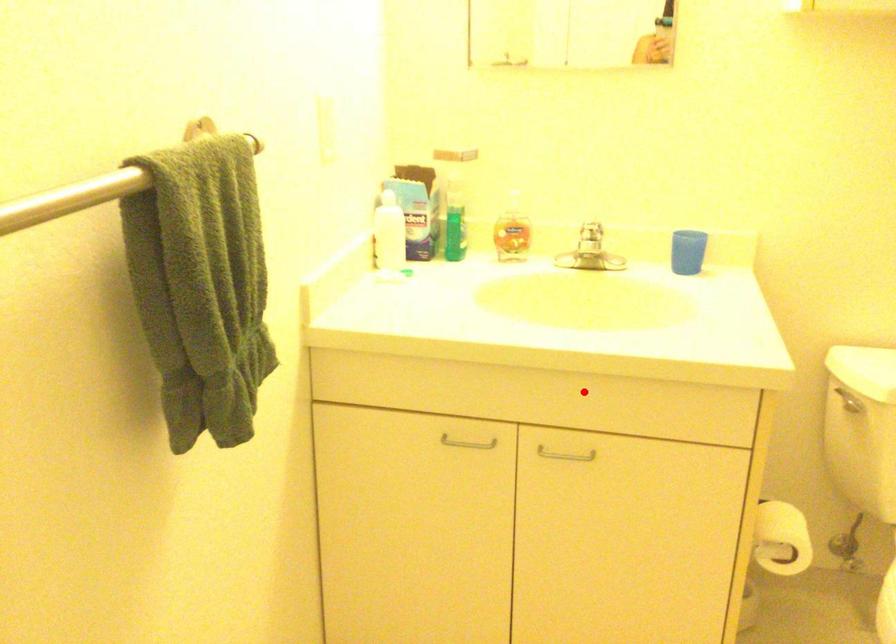
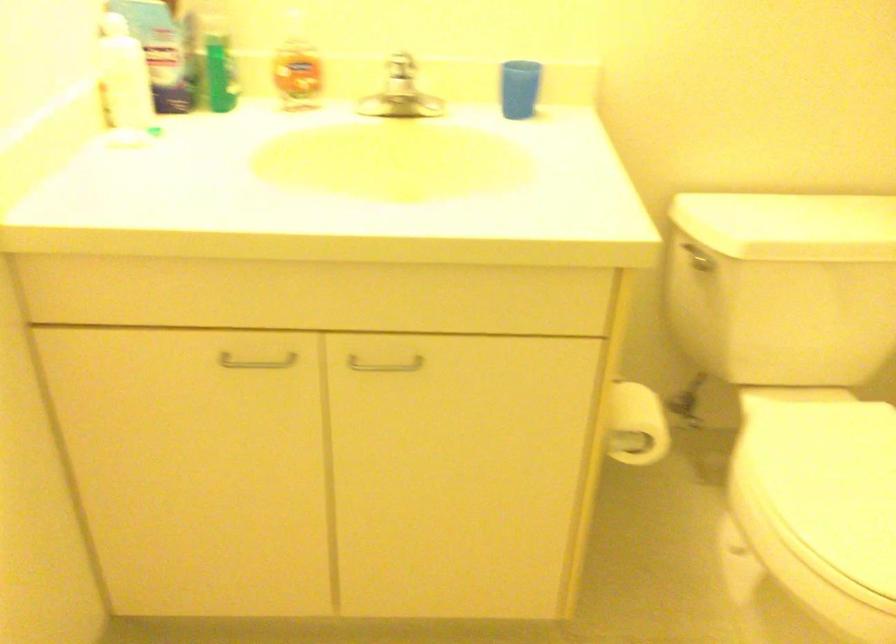
Where in the second image is the point corresponding to the highlighted location from the first image?

(400, 283)